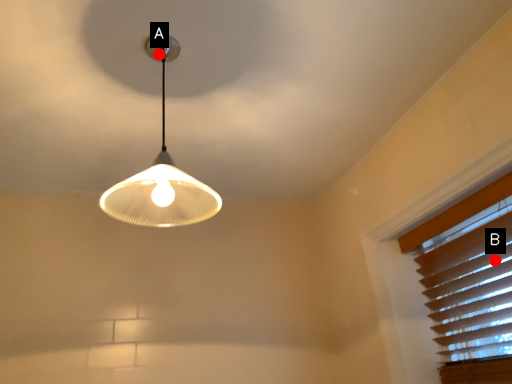
Question: Two points are circled on the image, labeled by A and B beside each circle. Which point appears closest to the camera in this image?

Choices:
 (A) A is closer
 (B) B is closer

Answer: (A)